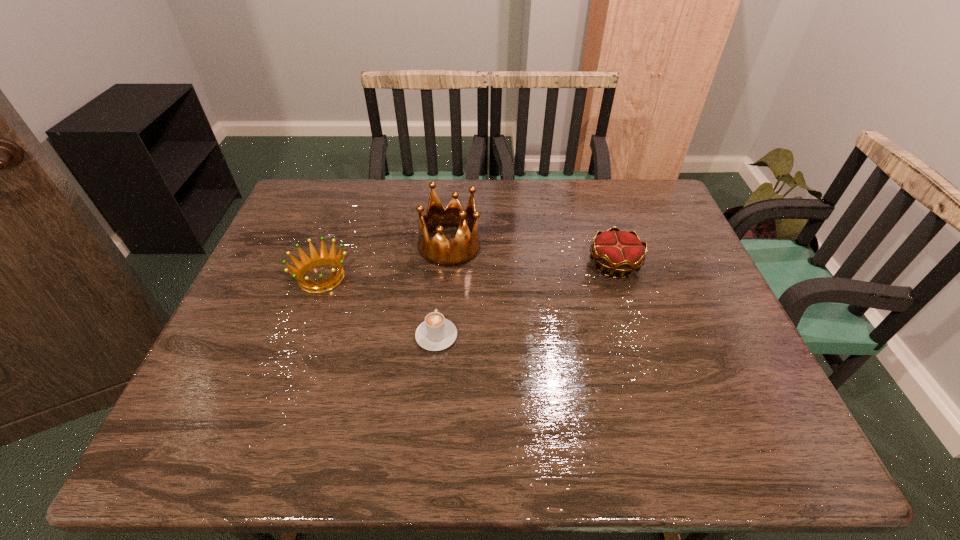
Identify the location of vacant space located 0.400m to the right of the cappuccino. (446, 220).

At what (x,y) coordinates should I click in order to perform the action: click on blank space located 0.110m to the right of the cappuccino. Please return your answer as a coordinate pair (x, y). Looking at the image, I should click on (441, 287).

You are a GUI agent. You are given a task and a screenshot of the screen. Output one action in this format:
    pyautogui.click(x=<x>, y=<y>)
    Task: Click on the object present at the left edge
    The height and width of the screenshot is (540, 960).
    Given the screenshot: What is the action you would take?
    pyautogui.click(x=315, y=260)

At what (x,y) coordinates should I click in order to perform the action: click on blank space at the far edge of the desktop. Please return your answer as a coordinate pair (x, y). Image resolution: width=960 pixels, height=540 pixels. Looking at the image, I should click on (403, 186).

In the image, there is a desktop. Where is `vacant region at the near edge`? vacant region at the near edge is located at coordinates (324, 451).

Where is `vacant space at the left edge of the desktop`? The image size is (960, 540). vacant space at the left edge of the desktop is located at coordinates (282, 260).

In order to click on free space at the right edge of the desktop in this screenshot , I will do `click(754, 406)`.

The width and height of the screenshot is (960, 540). Find the location of `free space between the leftmost object and the tallest crown`. free space between the leftmost object and the tallest crown is located at coordinates (386, 261).

Locate an element on the screen. free space between the leftmost object and the nearest object is located at coordinates (379, 307).

The image size is (960, 540). Identify the location of free area in between the nearest object and the leftmost crown. (379, 307).